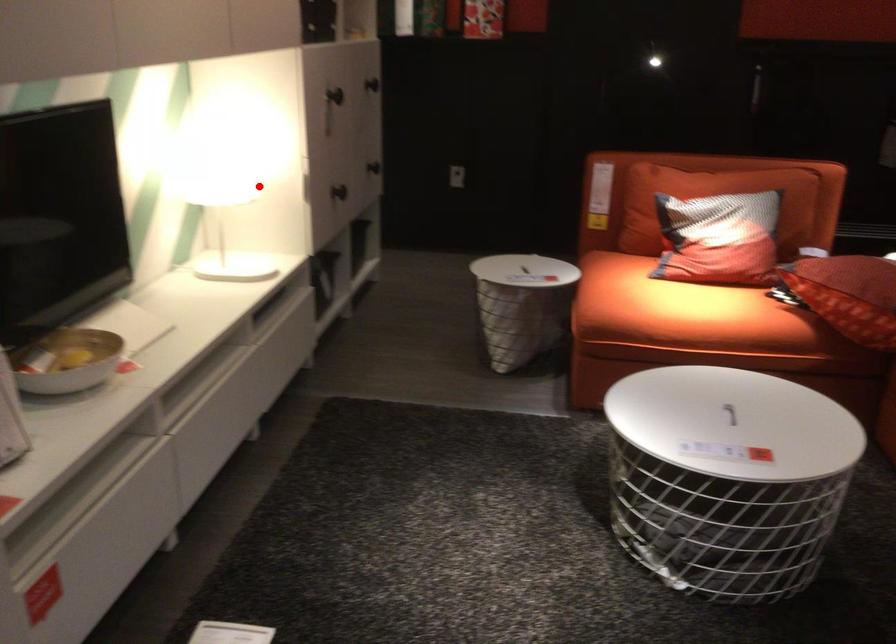
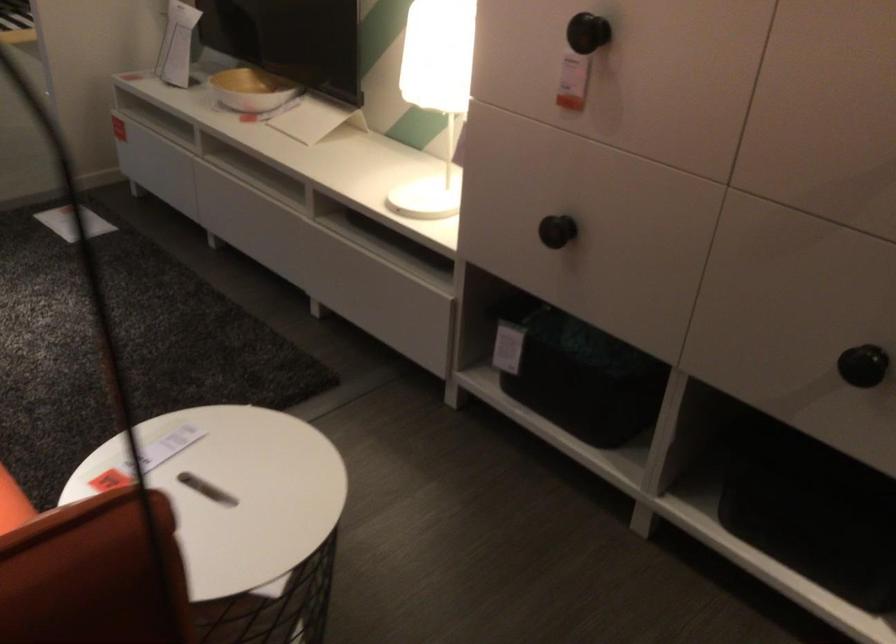
Question: I am providing you with two images of the same scene from different viewpoints. In image1, a red point is highlighted. Considering the same 3D point in image2, which of the following is correct?

Choices:
 (A) It is closer
 (B) It is farther

Answer: (A)